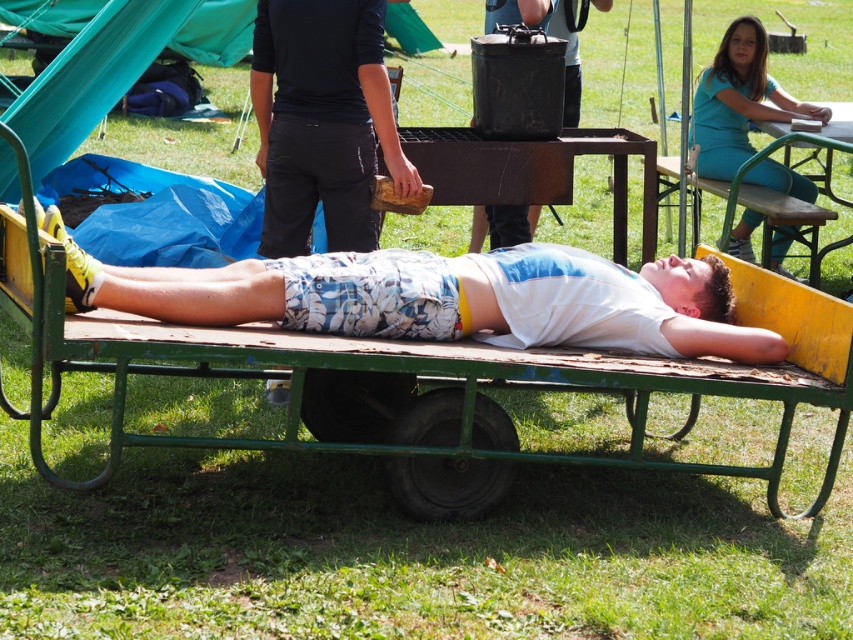
Looking at this image, does teal fabric pants at upper right have a greater width compared to wooden picnic table at upper right?

Correct, the width of teal fabric pants at upper right exceeds that of wooden picnic table at upper right.

Who is more forward, (x=717, y=106) or (x=851, y=108)?

Point (x=717, y=106)

Which is in front, point (785, 177) or point (830, 164)?

Point (785, 177) is more forward.

This screenshot has height=640, width=853. Identify the location of teal fabric pants at upper right. (738, 99).

Can you confirm if white matte shirt at center is thinner than green wood park bench at upper right?

No.

Can you confirm if white matte shirt at center is positioned above green wood park bench at upper right?

No.

Between point (296, 324) and point (784, 214), which one is positioned in front?

Point (296, 324) is more forward.

Identify the location of white matte shirt at center. This screenshot has width=853, height=640. (206, 294).

Can you confirm if teal fabric pants at upper right is smaller than black matte pot at upper center?

Yes, teal fabric pants at upper right is smaller than black matte pot at upper center.

Can you confirm if teal fabric pants at upper right is thinner than black matte pot at upper center?

Incorrect, teal fabric pants at upper right's width is not less than black matte pot at upper center's.

Between point (759, 38) and point (567, 116), which one is positioned behind?

Point (759, 38)

Where is `teal fabric pants at upper right`? This screenshot has height=640, width=853. teal fabric pants at upper right is located at coordinates (738, 99).